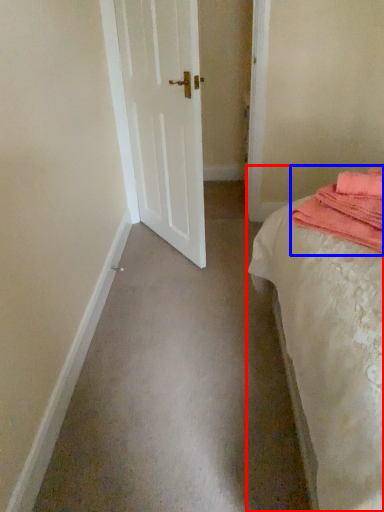
Question: Which of the following is the closest to the observer, bed (highlighted by a red box) or material (highlighted by a blue box)?

Choices:
 (A) bed
 (B) material

Answer: (A)